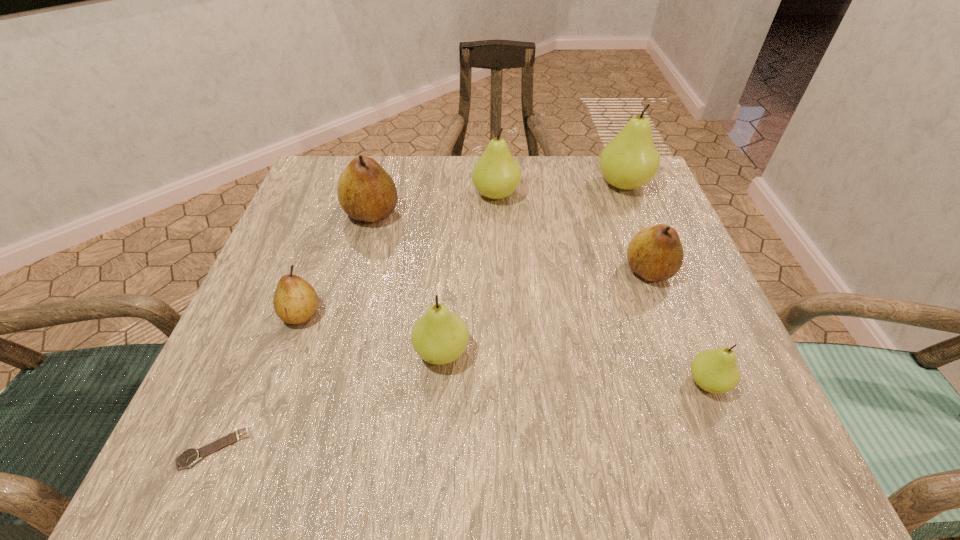
At what (x,y) coordinates should I click in order to perform the action: click on the nearest object. Please return your answer as a coordinate pair (x, y). Looking at the image, I should click on (189, 457).

Where is `vacant space located on the left of the tallest pear`? Image resolution: width=960 pixels, height=540 pixels. vacant space located on the left of the tallest pear is located at coordinates (569, 185).

The image size is (960, 540). Find the location of `free location located 0.210m on the left of the third smallest green pear`. free location located 0.210m on the left of the third smallest green pear is located at coordinates (381, 195).

Locate an element on the screen. The image size is (960, 540). free location located on the front of the biggest brown pear is located at coordinates (347, 303).

In order to click on blank area located 0.320m on the back of the second smallest brown pear in this screenshot , I will do `click(610, 166)`.

At what (x,y) coordinates should I click in order to perform the action: click on free point located 0.090m on the right of the third biggest green pear. Please return your answer as a coordinate pair (x, y). The image size is (960, 540). Looking at the image, I should click on (525, 352).

Identify the location of free point located on the front of the smallest brown pear. This screenshot has height=540, width=960. (275, 388).

This screenshot has height=540, width=960. Identify the location of vacant region located 0.290m on the left of the smallest green pear. (497, 383).

Locate an element on the screen. Image resolution: width=960 pixels, height=540 pixels. vacant space positioned on the right of the shortest object is located at coordinates (520, 448).

Find the location of a particular element. object that is at the near edge is located at coordinates (189, 457).